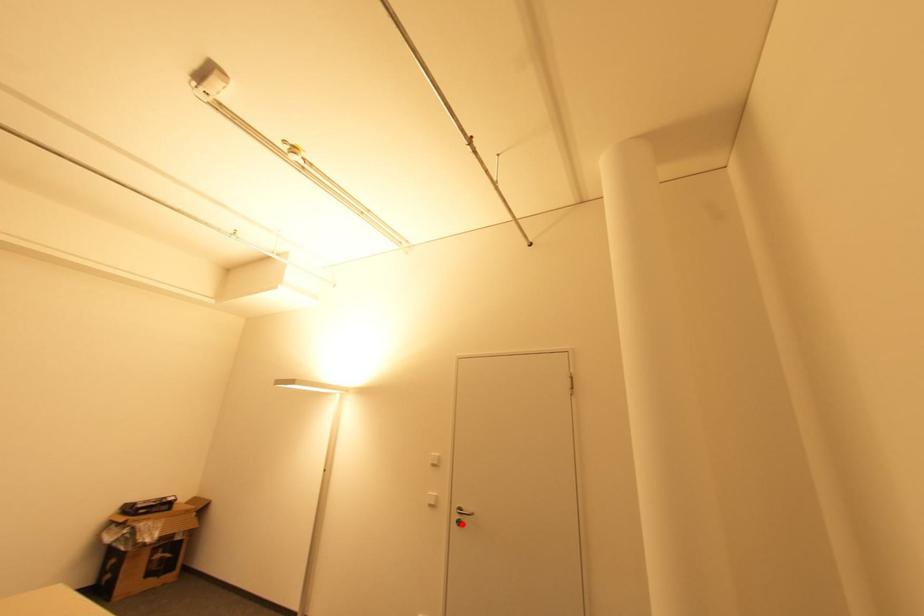
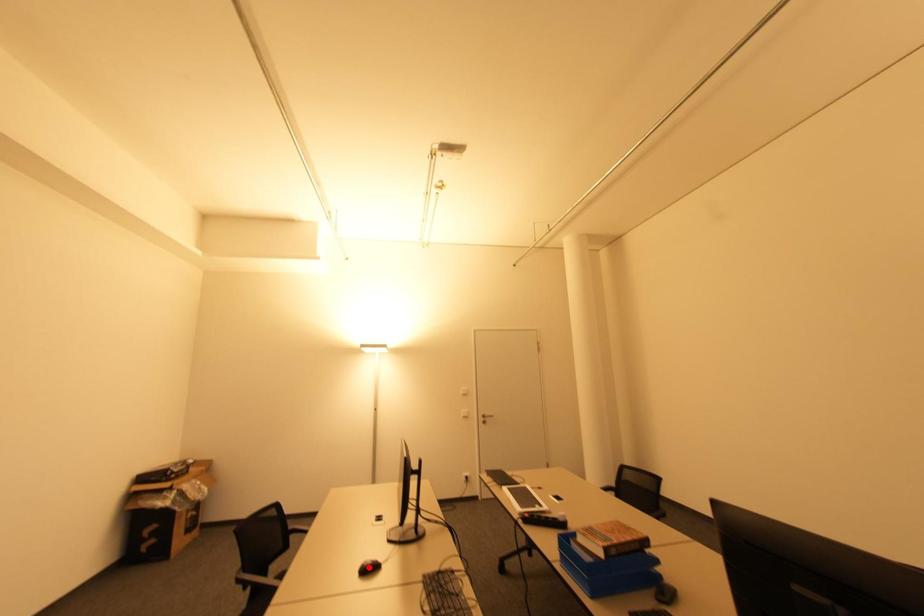
I am providing you with two images of the same scene from different viewpoints. A red point is marked on the first image and another point is marked on the second image. Are the points marked in image1 and image2 representing the same 3D position?

No